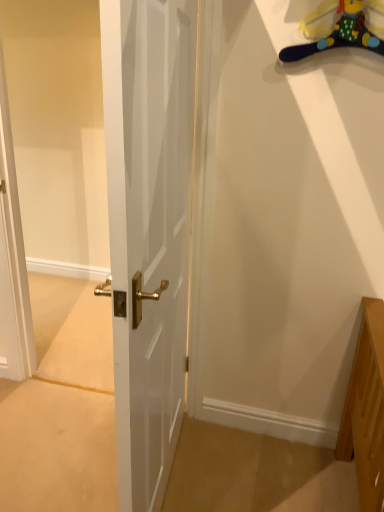
Image resolution: width=384 pixels, height=512 pixels. I want to click on plush yellow duck at upper right, so click(x=336, y=30).

Describe the element at coordinates (336, 30) in the screenshot. I see `plush yellow duck at upper right` at that location.

From the picture: Measure the distance between plush yellow duck at upper right and camera.

They are 1.26 meters apart.

Identify the location of white glossy door at center. (148, 231).

This screenshot has height=512, width=384. Describe the element at coordinates (148, 231) in the screenshot. I see `white glossy door at center` at that location.

The image size is (384, 512). Find the location of `plush yellow duck at upper right`. plush yellow duck at upper right is located at coordinates (336, 30).

Between white glossy door at center and plush yellow duck at upper right, which one appears on the right side from the viewer's perspective?

From the viewer's perspective, plush yellow duck at upper right appears more on the right side.

Which object is closer to the camera, white glossy door at center or plush yellow duck at upper right?

white glossy door at center.

Looking at this image, which point is more forward, (x=113, y=305) or (x=349, y=17)?

Positioned in front is point (x=113, y=305).

From the image's perspective, relative to plush yellow duck at upper right, is white glossy door at center above or below?

From the image's perspective, white glossy door at center appears below plush yellow duck at upper right.

Looking at this image, from a real-world perspective, is white glossy door at center beneath plush yellow duck at upper right?

Yes, from a real-world perspective, white glossy door at center is beneath plush yellow duck at upper right.

Considering the relative sizes of white glossy door at center and plush yellow duck at upper right in the image provided, is white glossy door at center wider than plush yellow duck at upper right?

Correct, the width of white glossy door at center exceeds that of plush yellow duck at upper right.

Considering the sizes of white glossy door at center and plush yellow duck at upper right in the image, is white glossy door at center taller or shorter than plush yellow duck at upper right?

Clearly, white glossy door at center is taller compared to plush yellow duck at upper right.

Between white glossy door at center and plush yellow duck at upper right, which one has larger size?

With larger size is white glossy door at center.

Is plush yellow duck at upper right a part of white glossy door at center?

No, plush yellow duck at upper right is not inside white glossy door at center.

From the picture: Is white glossy door at center placed right next to plush yellow duck at upper right?

There is a gap between white glossy door at center and plush yellow duck at upper right.

Is white glossy door at center oriented towards plush yellow duck at upper right?

No, white glossy door at center is not facing towards plush yellow duck at upper right.

How different are the orientations of white glossy door at center and plush yellow duck at upper right in degrees?

81 degrees.

Locate an element on the screen. door below the plush yellow duck at upper right (from the image's perspective) is located at coordinates (148, 231).

Visually, is plush yellow duck at upper right positioned to the left or to the right of white glossy door at center?

Clearly, plush yellow duck at upper right is on the right of white glossy door at center in the image.

Who is more distant, plush yellow duck at upper right or white glossy door at center?

Positioned behind is plush yellow duck at upper right.

Is point (349, 23) positioned before point (134, 291)?

No, it is behind (134, 291).

From the image's perspective, is plush yellow duck at upper right located above or below white glossy door at center?

Based on their image positions, plush yellow duck at upper right is located above white glossy door at center.

From a real-world perspective, is plush yellow duck at upper right above or below white glossy door at center?

Clearly, from a real-world perspective, plush yellow duck at upper right is above white glossy door at center.

Between plush yellow duck at upper right and white glossy door at center, which one has larger width?

With larger width is white glossy door at center.

Considering the sizes of objects plush yellow duck at upper right and white glossy door at center in the image provided, who is shorter, plush yellow duck at upper right or white glossy door at center?

Standing shorter between the two is plush yellow duck at upper right.

Does plush yellow duck at upper right have a larger size compared to white glossy door at center?

No, plush yellow duck at upper right is not bigger than white glossy door at center.

Is plush yellow duck at upper right completely or partially outside of white glossy door at center?

plush yellow duck at upper right is positioned outside white glossy door at center.

Are plush yellow duck at upper right and white glossy door at center beside each other?

No, plush yellow duck at upper right is not making contact with white glossy door at center.

Is plush yellow duck at upper right facing towards white glossy door at center?

No, plush yellow duck at upper right does not turn towards white glossy door at center.

How distant is plush yellow duck at upper right from white glossy door at center?

26.43 inches.

In the image, there is a white glossy door at center. In order to click on toy above it (from the image's perspective) in this screenshot , I will do `click(336, 30)`.

The height and width of the screenshot is (512, 384). I want to click on toy located above the white glossy door at center (from the image's perspective), so click(x=336, y=30).

The height and width of the screenshot is (512, 384). Identify the location of toy that is behind the white glossy door at center. (336, 30).